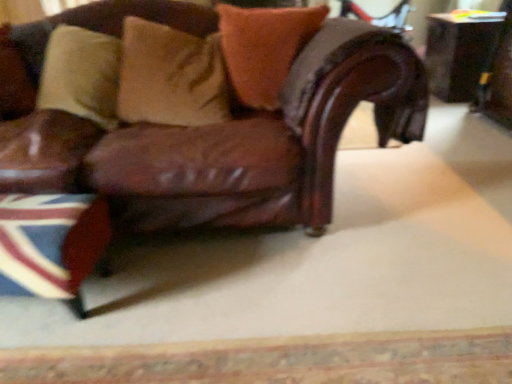
Question: From a real-world perspective, is shiny black swivel chair at upper right physically below wooden table at right?

Choices:
 (A) yes
 (B) no

Answer: (B)

Question: From a real-world perspective, is shiny black swivel chair at upper right located higher than wooden table at right?

Choices:
 (A) no
 (B) yes

Answer: (B)

Question: From the image's perspective, is shiny black swivel chair at upper right located beneath wooden table at right?

Choices:
 (A) yes
 (B) no

Answer: (A)

Question: Can you confirm if shiny black swivel chair at upper right is thinner than wooden table at right?

Choices:
 (A) no
 (B) yes

Answer: (B)

Question: Can you see shiny black swivel chair at upper right touching wooden table at right?

Choices:
 (A) yes
 (B) no

Answer: (B)

Question: Considering the relative positions of shiny black swivel chair at upper right and wooden table at right in the image provided, is shiny black swivel chair at upper right in front of wooden table at right?

Choices:
 (A) no
 (B) yes

Answer: (B)

Question: From a real-world perspective, is wooden table at right physically below brown leather chair at center?

Choices:
 (A) no
 (B) yes

Answer: (B)

Question: Could you tell me if wooden table at right is turned towards brown leather chair at center?

Choices:
 (A) no
 (B) yes

Answer: (A)

Question: Can you confirm if wooden table at right is smaller than brown leather chair at center?

Choices:
 (A) no
 (B) yes

Answer: (B)

Question: Considering the relative sizes of wooden table at right and brown leather chair at center in the image provided, is wooden table at right thinner than brown leather chair at center?

Choices:
 (A) yes
 (B) no

Answer: (A)

Question: Is the position of wooden table at right more distant than that of brown leather chair at center?

Choices:
 (A) no
 (B) yes

Answer: (B)

Question: Is the depth of wooden table at right less than that of brown leather chair at center?

Choices:
 (A) yes
 (B) no

Answer: (B)

Question: Can you confirm if brown leather pillow at upper left, the first pillow from the left, is taller than suede-like beige pillow at upper center, positioned as the second pillow in left-to-right order?

Choices:
 (A) no
 (B) yes

Answer: (A)